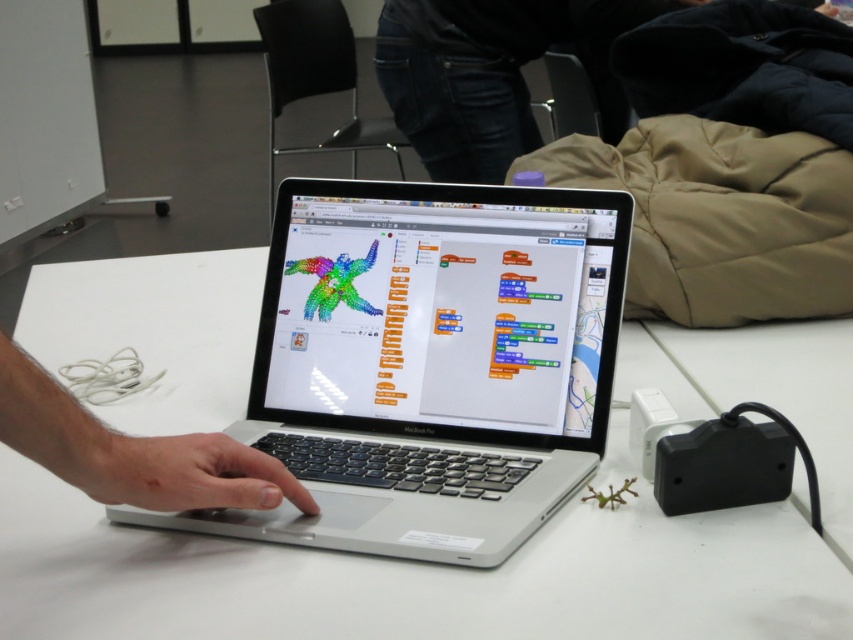
Is silver metallic laptop at center smaller than matte black hand at center?

No.

From the picture: Which of these two, silver metallic laptop at center or matte black hand at center, stands shorter?

matte black hand at center is shorter.

Identify the location of silver metallic laptop at center. (x=428, y=364).

How distant is white glossy table at center from silver metallic laptop at center?

The distance of white glossy table at center from silver metallic laptop at center is 6.70 inches.

Is white glossy table at center above silver metallic laptop at center?

Indeed, white glossy table at center is positioned over silver metallic laptop at center.

The width and height of the screenshot is (853, 640). What do you see at coordinates (416, 577) in the screenshot?
I see `white glossy table at center` at bounding box center [416, 577].

Locate an element on the screen. This screenshot has height=640, width=853. white glossy table at center is located at coordinates (416, 577).

Between white glossy table at center and matte black hand at center, which one appears on the left side from the viewer's perspective?

matte black hand at center

Who is lower down, white glossy table at center or matte black hand at center?

matte black hand at center is below.

Measure the distance between point (796,384) and camera.

The distance of point (796,384) from camera is 39.37 inches.

You are a GUI agent. You are given a task and a screenshot of the screen. Output one action in this format:
    pyautogui.click(x=<x>, y=<y>)
    Task: Click on the white glossy table at center
    
    Given the screenshot: What is the action you would take?
    pyautogui.click(x=416, y=577)